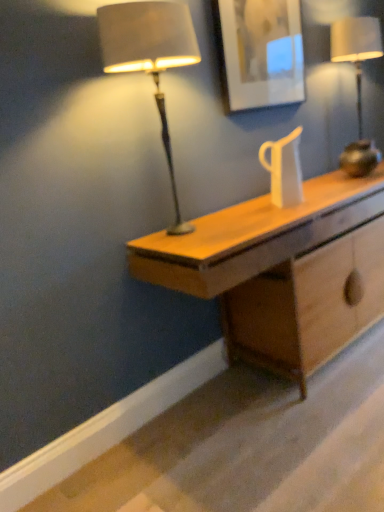
Find the location of a particular element. free space in front of matte brown lamp at left, the 1th lamp when ordered from front to back is located at coordinates (209, 241).